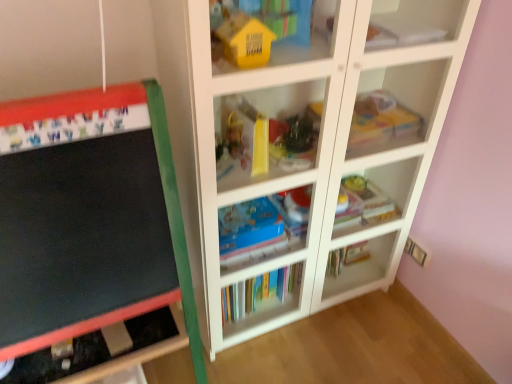
Question: In terms of width, does shiny plastic toy at center, which is the 2th toy in right-to-left order, look wider or thinner when compared to white glossy bookshelf at center, which is counted as the 1th shelf, starting from the top?

Choices:
 (A) thin
 (B) wide

Answer: (A)

Question: From a real-world perspective, relative to white glossy bookshelf at center, the 2th shelf ordered from the bottom, is shiny plastic toy at center, the second toy when ordered from back to front, vertically above or below?

Choices:
 (A) below
 (B) above

Answer: (B)

Question: Which object is positioned closest to the white paper at upper right, which ranks as the 1th book in top-to-bottom order?

Choices:
 (A) translucent plastic toy at upper right, the third toy viewed from the front
 (B) blue cardboard book at center, placed as the 2th shelf when sorted from top to bottom
 (C) shiny plastic toy at center, the 2th toy from the front
 (D) multicolored paperbacks at center, arranged as the 1th book when ordered from the bottom
 (E) yellow matte house at upper center, marked as the third toy in a back-to-front arrangement

Answer: (A)

Question: Which object is the closest to the multicolored paperbacks at center, the third book viewed from the top?

Choices:
 (A) white paper at upper right, which ranks as the 1th book in top-to-bottom order
 (B) shiny plastic toy at center, the second toy when ordered from back to front
 (C) matte blue book at center, which is the 2th book from top to bottom
 (D) white glossy bookshelf at center, the 2th shelf ordered from the bottom
 (E) blue cardboard book at center, the 1th shelf in the bottom-to-top sequence

Answer: (E)